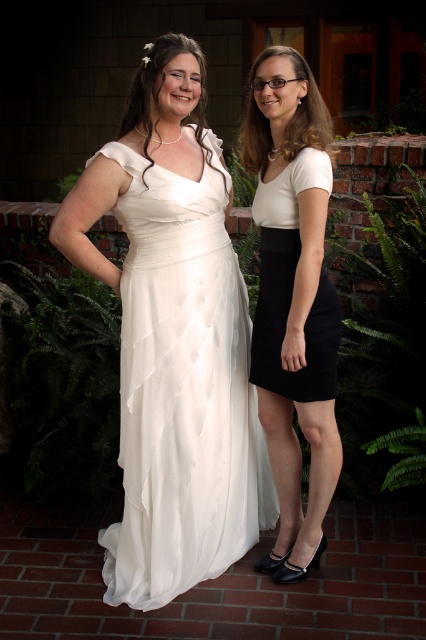
What is the color of the blouse at the point located at coordinates (293, 300)?

The point at coordinates (293, 300) is on the matte white blouse at center, so the color is white.

You are a fashion designer who needs to create a matching outfit. Given the matte white blouse at center and the black matte skirt at right, which item would you recommend to be paired with a wider belt?

The matte white blouse at center has a larger width than the black matte skirt at right, so the wider belt would be better suited for the matte white blouse at center since it can accommodate the broader silhouette.

Based on the photo, you are a photographer planning to capture a portrait of the two women in the scene. The white satin dress at center and the black matte skirt at right are both in the frame. Considering their sizes, which one should you focus on to ensure it appears more prominent in the photo?

The white satin dress at center has a larger size compared to the black matte skirt at right, so focusing on the white satin dress at center will make it appear more prominent in the photo.